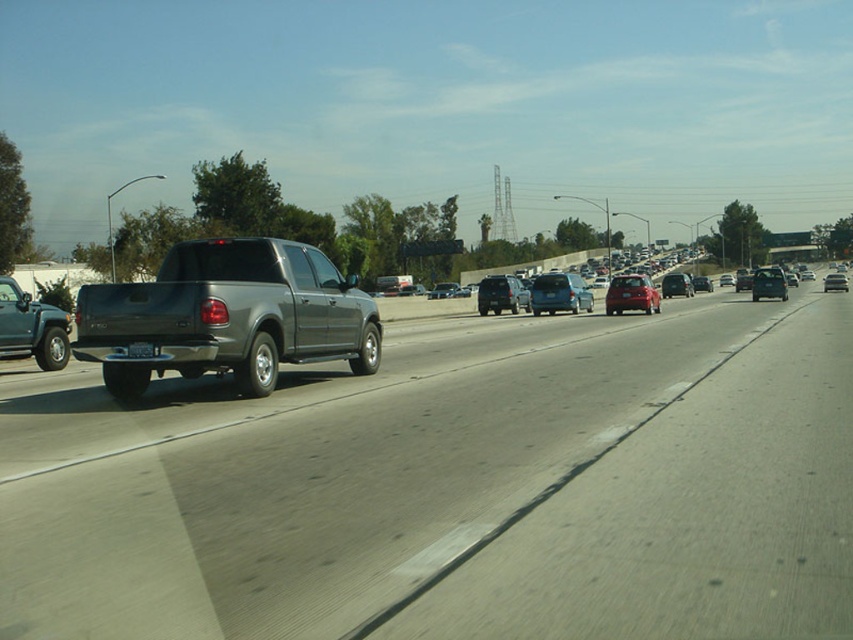
Measure the distance from metallic gray pickup truck at center to satin black suv at center.

The distance of metallic gray pickup truck at center from satin black suv at center is 31.00 meters.

Where is `metallic gray pickup truck at center`? metallic gray pickup truck at center is located at coordinates (228, 316).

Between point (627, 298) and point (521, 288), which one is positioned in front?

Point (627, 298) is more forward.

Who is positioned more to the right, shiny red sedan at center or satin black suv at center?

shiny red sedan at center

Is point (621, 292) positioned behind point (483, 301)?

No, it is in front of (483, 301).

Locate an element on the screen. This screenshot has width=853, height=640. shiny red sedan at center is located at coordinates (631, 294).

Where is `matte gray truck at center`? The height and width of the screenshot is (640, 853). matte gray truck at center is located at coordinates (451, 486).

Is matte gray truck at center positioned before shiny black sedan at right?

Yes.

Describe the element at coordinates (451, 486) in the screenshot. I see `matte gray truck at center` at that location.

Locate an element on the screen. The height and width of the screenshot is (640, 853). matte gray truck at center is located at coordinates tap(451, 486).